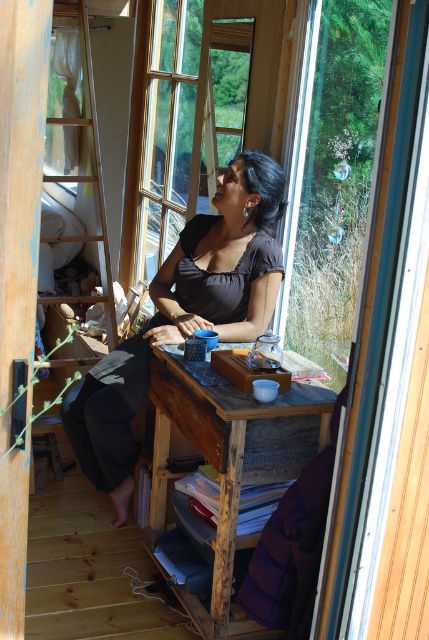
Question: Is matte black shirt at center thinner than wooden ladder at left?

Choices:
 (A) no
 (B) yes

Answer: (A)

Question: Which object is closer to the camera taking this photo?

Choices:
 (A) matte black shirt at center
 (B) wooden ladder at left

Answer: (A)

Question: In this image, where is wooden table at center located relative to wooden ladder at left?

Choices:
 (A) left
 (B) right

Answer: (B)

Question: Is matte black shirt at center closer to the viewer compared to wooden table at center?

Choices:
 (A) no
 (B) yes

Answer: (A)

Question: Which point is farther to the camera?

Choices:
 (A) (277, 272)
 (B) (96, 224)

Answer: (B)

Question: Estimate the real-world distances between objects in this image. Which object is closer to the matte black shirt at center?

Choices:
 (A) wooden ladder at left
 (B) wooden table at center

Answer: (B)